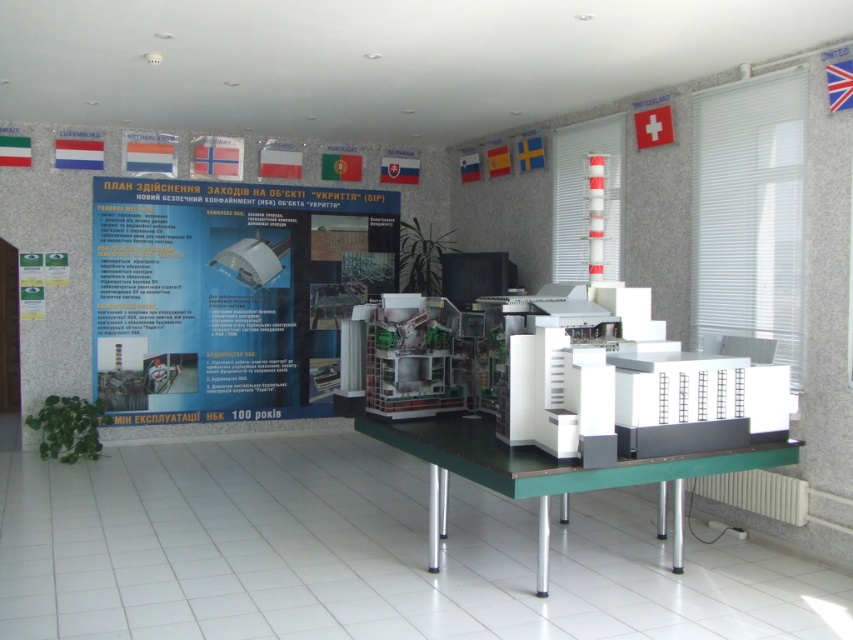
Question: Among these points, which one is farthest from the camera?

Choices:
 (A) (514, 483)
 (B) (155, 205)

Answer: (B)

Question: Which point is closer to the camera?

Choices:
 (A) (206, 294)
 (B) (428, 417)

Answer: (B)

Question: Considering the relative positions of white paper at center and green plastic table at center in the image provided, where is white paper at center located with respect to green plastic table at center?

Choices:
 (A) below
 (B) above

Answer: (B)

Question: Which of the following is the closest to the observer?

Choices:
 (A) green plastic table at center
 (B) white paper at center

Answer: (A)

Question: Does white paper at center appear over green plastic table at center?

Choices:
 (A) yes
 (B) no

Answer: (A)

Question: Is white paper at center below green plastic table at center?

Choices:
 (A) no
 (B) yes

Answer: (A)